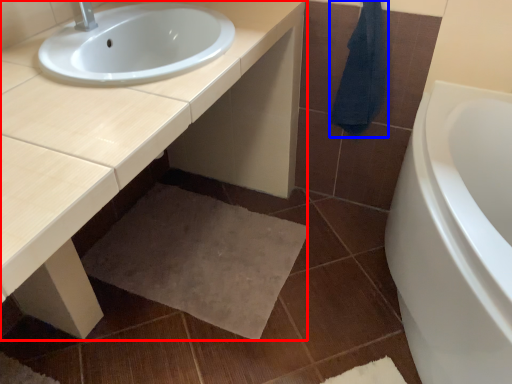
Question: Which point is further to the camera, countertop (highlighted by a red box) or bath towel (highlighted by a blue box)?

Choices:
 (A) countertop
 (B) bath towel

Answer: (B)